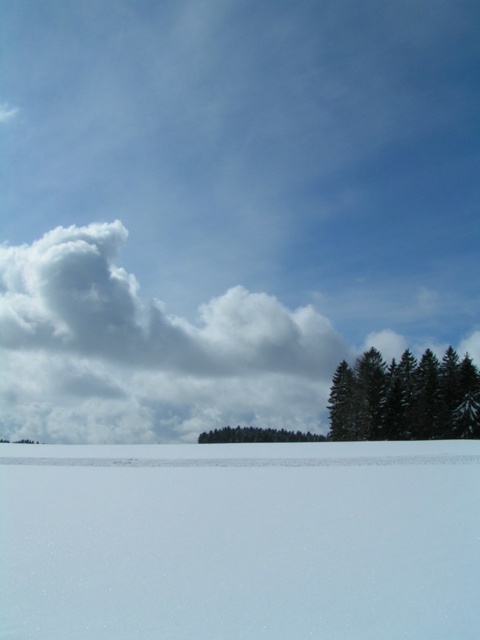
Can you confirm if white smooth snow at bottom is shorter than green matte trees at lower right?

Correct, white smooth snow at bottom is not as tall as green matte trees at lower right.

The image size is (480, 640). What do you see at coordinates (240, 540) in the screenshot? I see `white smooth snow at bottom` at bounding box center [240, 540].

Where is `white smooth snow at bottom`? white smooth snow at bottom is located at coordinates (240, 540).

From the picture: Does white smooth snow at bottom appear under green matte trees at center?

Actually, white smooth snow at bottom is above green matte trees at center.

Can you confirm if white smooth snow at bottom is wider than green matte trees at center?

Indeed, white smooth snow at bottom has a greater width compared to green matte trees at center.

Between point (55, 493) and point (253, 440), which one is positioned behind?

The point (253, 440) is more distant.

At what (x,y) coordinates should I click in order to perform the action: click on white smooth snow at bottom. Please return your answer as a coordinate pair (x, y). Looking at the image, I should click on (240, 540).

Is green matte trees at lower right shorter than green matte trees at center?

In fact, green matte trees at lower right may be taller than green matte trees at center.

Can you confirm if green matte trees at lower right is positioned to the left of green matte trees at center?

Incorrect, green matte trees at lower right is not on the left side of green matte trees at center.

Is point (478, 424) farther from viewer compared to point (279, 440)?

No, it is not.

The height and width of the screenshot is (640, 480). Find the location of `green matte trees at lower right`. green matte trees at lower right is located at coordinates (405, 397).